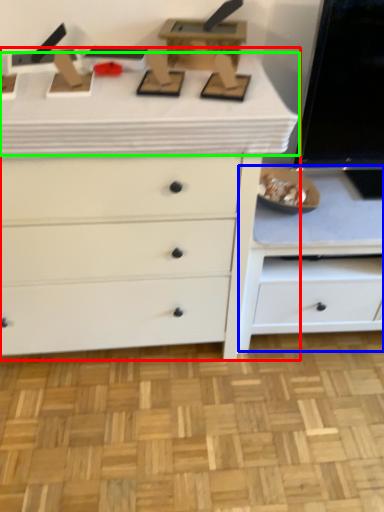
Question: Estimate the real-world distances between objects in this image. Which object is farther from chest of drawers (highlighted by a red box), cabinetry (highlighted by a blue box) or counter top (highlighted by a green box)?

Choices:
 (A) cabinetry
 (B) counter top

Answer: (A)